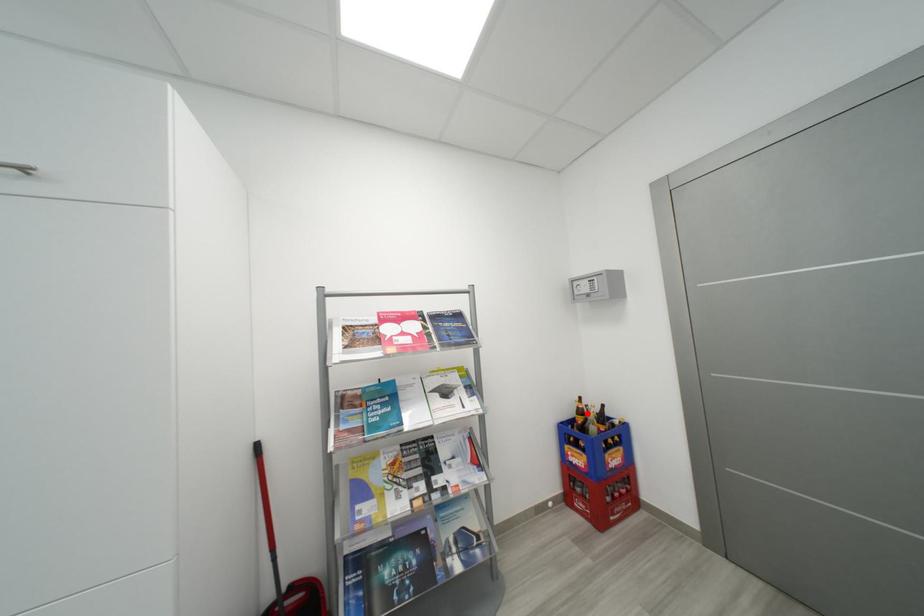
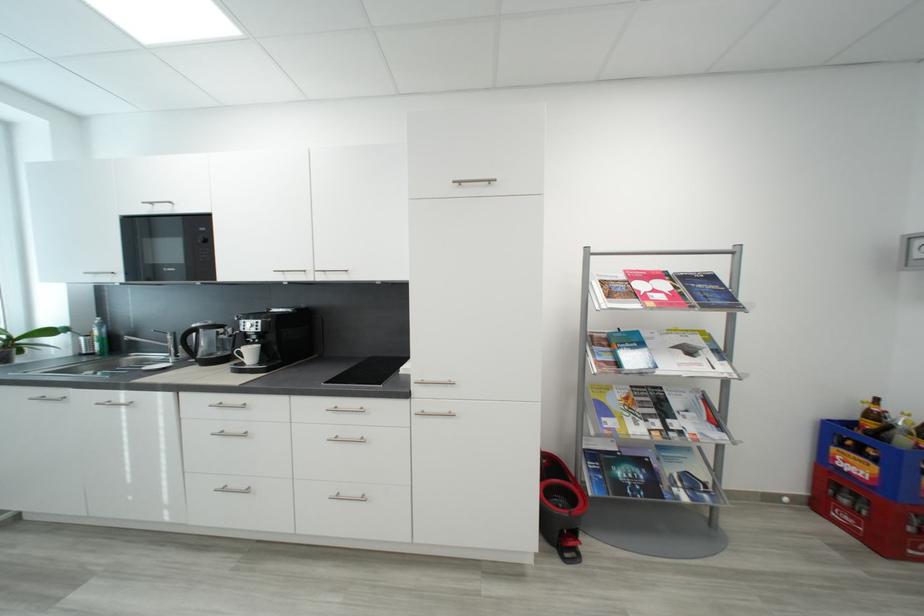
Question: I am providing you with two images of the same scene from different viewpoints. Image1 has a red point marked. In image2, the corresponding 3D location appears at what relative position? Reply with the corresponding letter.

Choices:
 (A) Closer
 (B) Farther

Answer: (A)